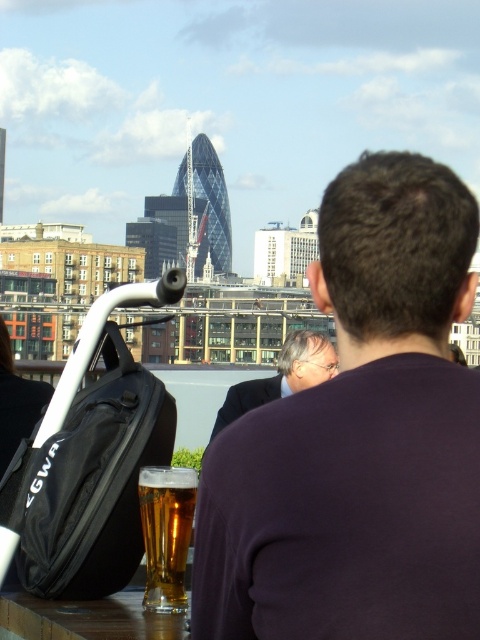
Is dark purple shirt at center shorter than translucent glass at lower center?

Incorrect, dark purple shirt at center's height does not fall short of translucent glass at lower center's.

Does dark purple shirt at center appear under translucent glass at lower center?

No.

Is point (235, 422) farther from viewer compared to point (178, 595)?

That is False.

Where is `dark purple shirt at center`? dark purple shirt at center is located at coordinates (360, 438).

Can you confirm if translucent glass at lower center is positioned to the left of dark suit at center?

Yes, translucent glass at lower center is to the left of dark suit at center.

Is translucent glass at lower center positioned before dark suit at center?

Yes.

Where is `translucent glass at lower center`? translucent glass at lower center is located at coordinates (166, 532).

You are a GUI agent. You are given a task and a screenshot of the screen. Output one action in this format:
    pyautogui.click(x=<x>, y=<y>)
    Task: Click on the translucent glass at lower center
    
    Given the screenshot: What is the action you would take?
    pyautogui.click(x=166, y=532)

Where is `dark purple shirt at center`? Image resolution: width=480 pixels, height=640 pixels. dark purple shirt at center is located at coordinates (360, 438).

This screenshot has width=480, height=640. What are the coordinates of `dark purple shirt at center` in the screenshot? It's located at (360, 438).